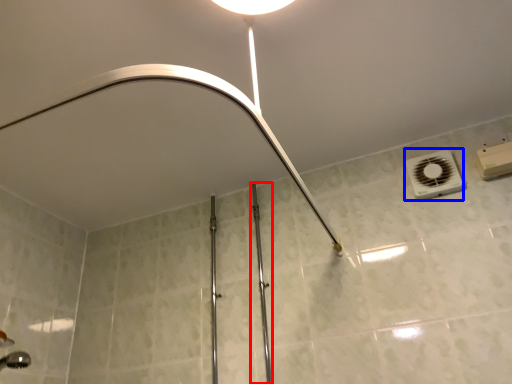
Question: Among these objects, which one is farthest to the camera, rail (highlighted by a red box) or air conditioning (highlighted by a blue box)?

Choices:
 (A) rail
 (B) air conditioning

Answer: (B)